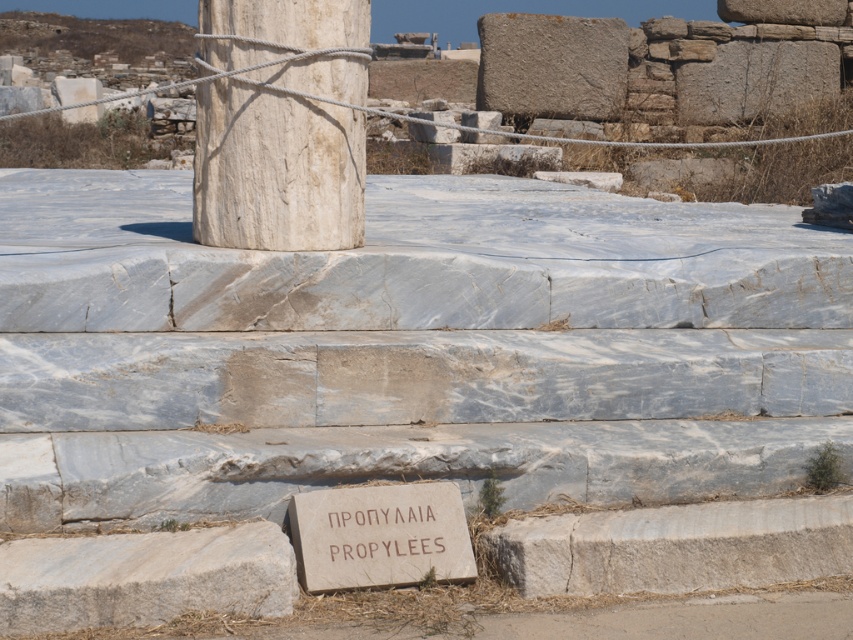
Does white marble column at center have a larger size compared to brown stone sign at center?

Yes.

Who is more distant from viewer, (299, 182) or (444, 554)?

Point (299, 182)

The image size is (853, 640). I want to click on white marble column at center, so click(276, 170).